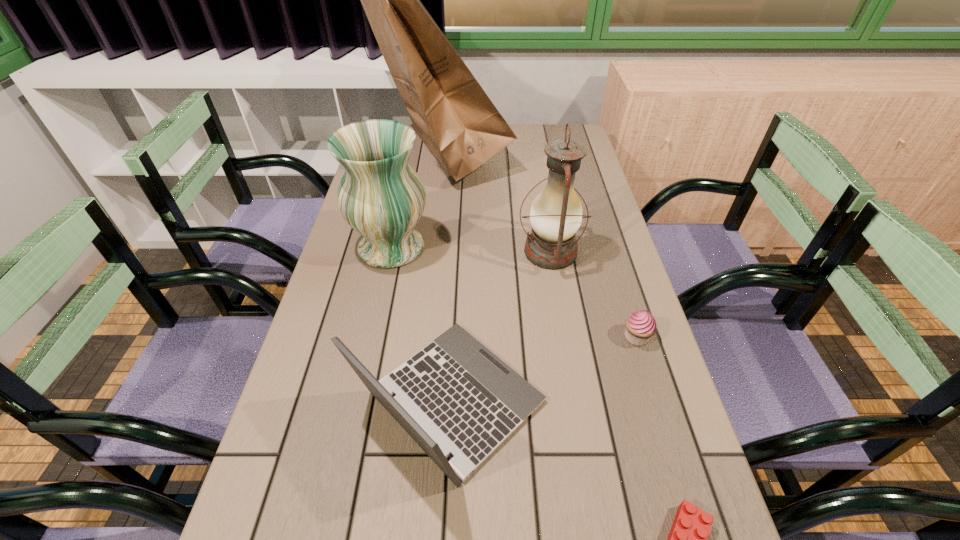
In order to click on free space in the image that satisfies the following two spatial constraints: 1. on the front side of the cupcake; 2. on the left side of the tallest object in this screenshot , I will do `click(422, 337)`.